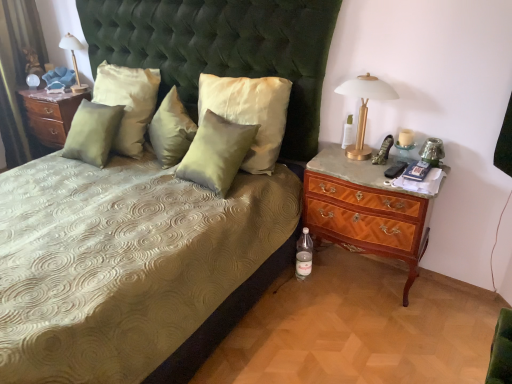
You are a GUI agent. You are given a task and a screenshot of the screen. Output one action in this format:
    pyautogui.click(x=<x>, y=<y>)
    Task: Click on the vacant point above mahogany wood nightstand at right, placed as the first nightstand when sorted from front to back (from a real-world perspective)
    
    Given the screenshot: What is the action you would take?
    pyautogui.click(x=370, y=167)